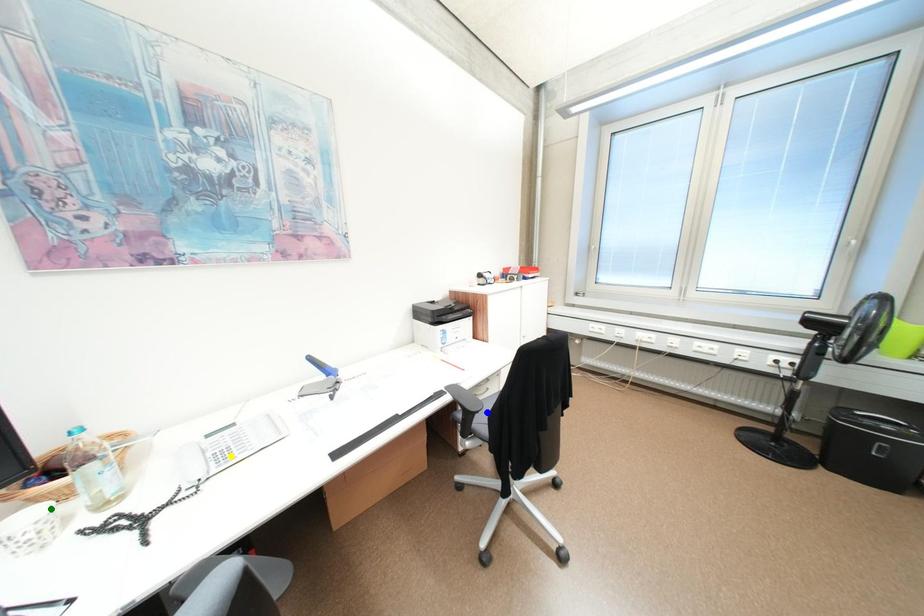
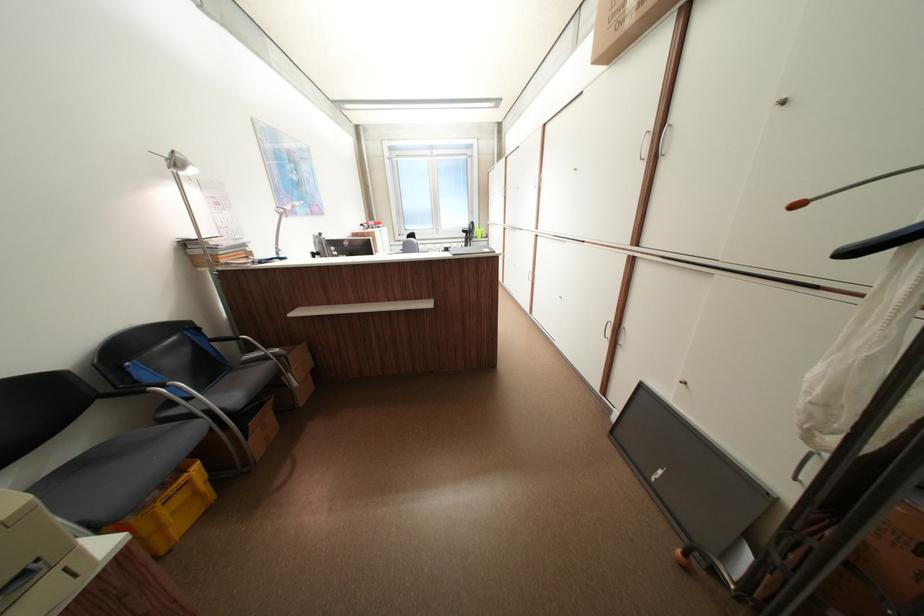
I am providing you with two images of the same scene from different viewpoints. Three points are marked in image1. Which point corresponds to a part or object that is occluded in image2?In image1, three points are marked. Which of them correspond to a part or object that is occluded in image2?Among the three points shown in image1, which one corresponds to a part or object that is no longer visible due to occlusion in image2?

Invisible in image2: yellow point, green point.